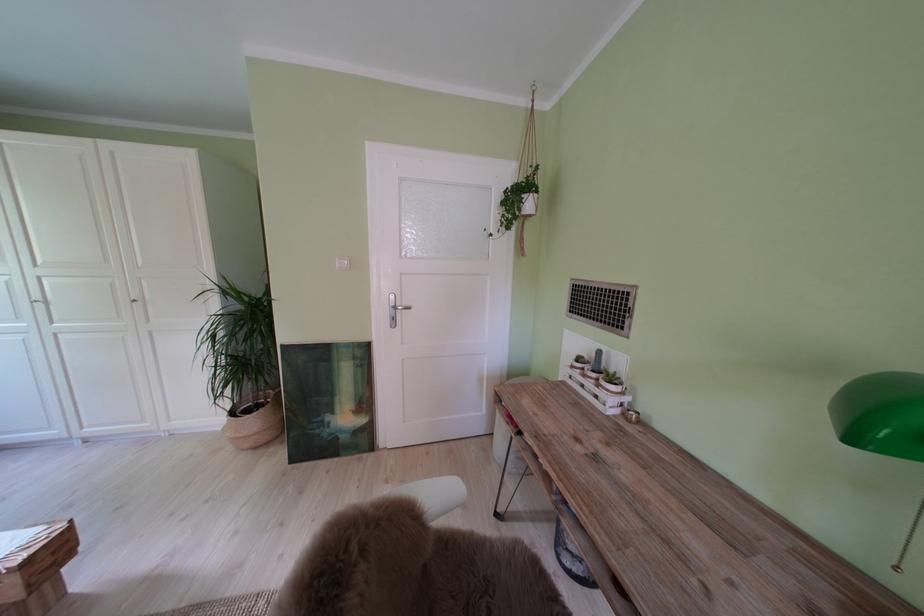
This screenshot has width=924, height=616. Describe the element at coordinates (394, 310) in the screenshot. I see `a silver door handle` at that location.